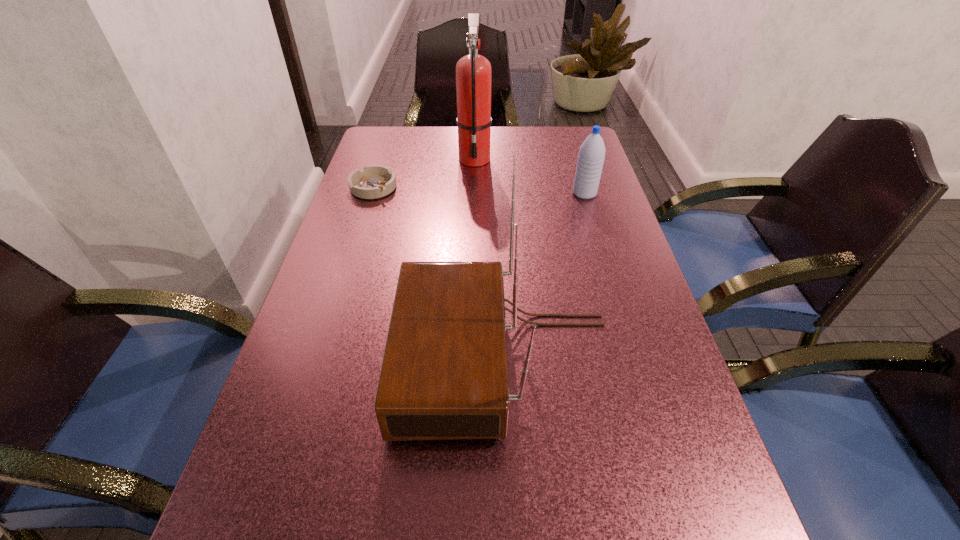
Identify which object is located as the nearest to the nearest object. Please provide its 2D coordinates. Your answer should be formatted as a tuple, i.e. [(x, y)], where the tuple contains the x and y coordinates of a point satisfying the conditions above.

[(591, 156)]

I want to click on free space that satisfies the following two spatial constraints: 1. on the front side of the second shortest object; 2. on the left side of the leftmost object, so click(372, 194).